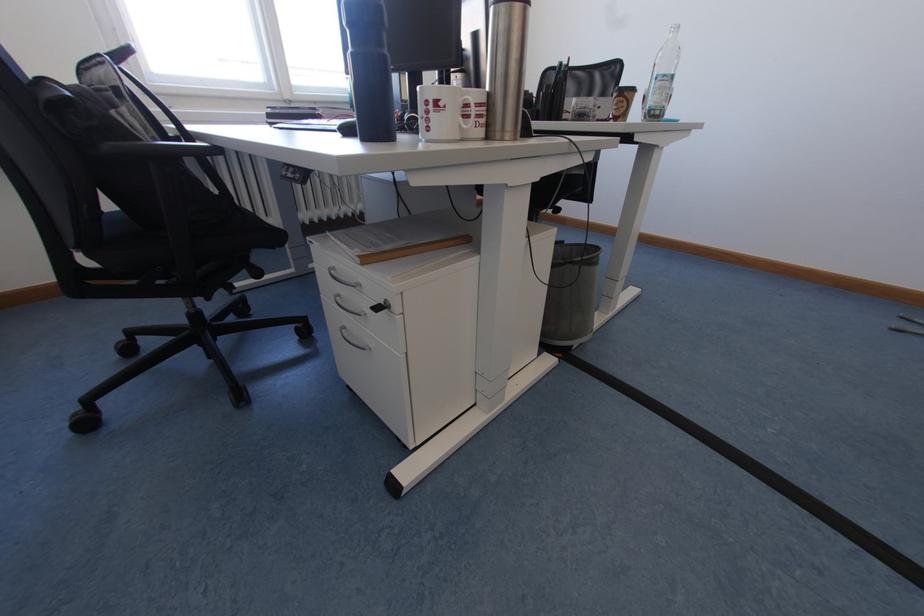
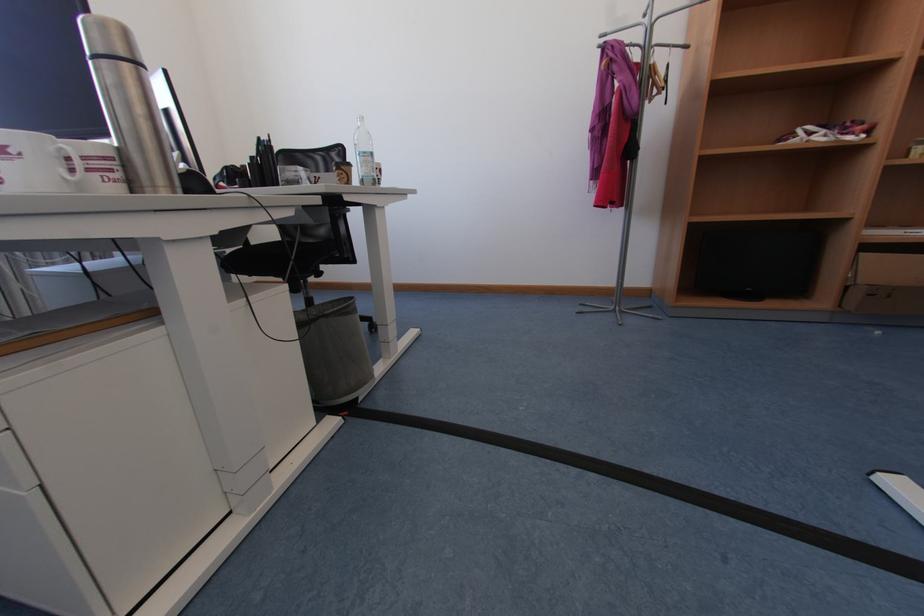
Question: How did the camera likely rotate?

Choices:
 (A) Left
 (B) Right
 (C) Up
 (D) Down

Answer: (B)